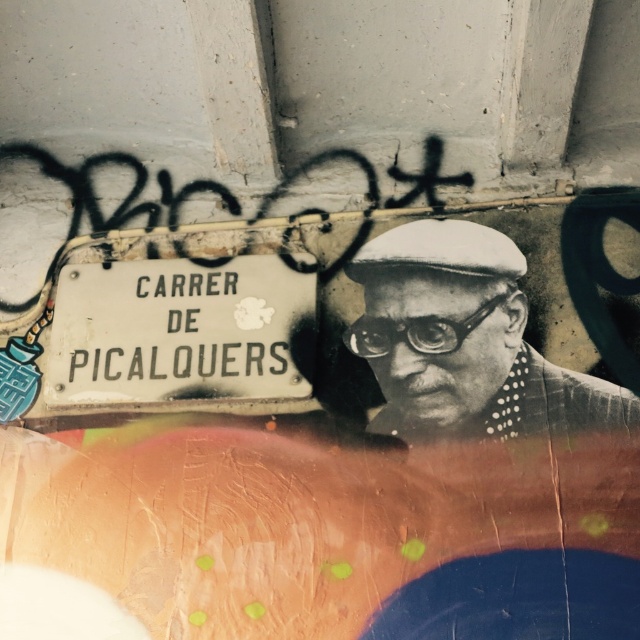
You are standing in front of the street sign on the wall. There is a point marked at coordinates (465, 342). What object is located at that point?

The point at (465, 342) marks the location of the black textured hat at center.

In the scene shown: You are standing in front of the street sign and want to place two markers on the ground. The first marker is at point (365, 291) and the second at point (241, 349). Which marker is closer to you?

Point (241, 349) is closer to you because it is in front of point (365, 291).